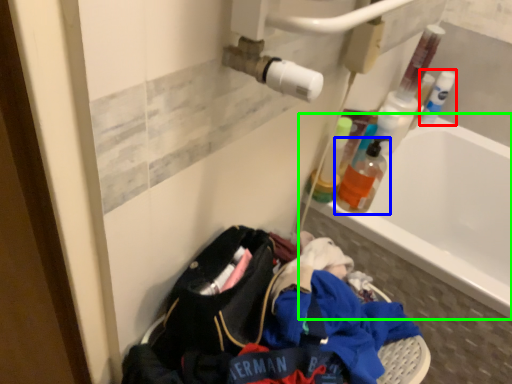
Question: Estimate the real-world distances between objects in this image. Which object is farther from bottle (highlighted by a red box), bottle (highlighted by a blue box) or bathtub (highlighted by a green box)?

Choices:
 (A) bottle
 (B) bathtub

Answer: (A)